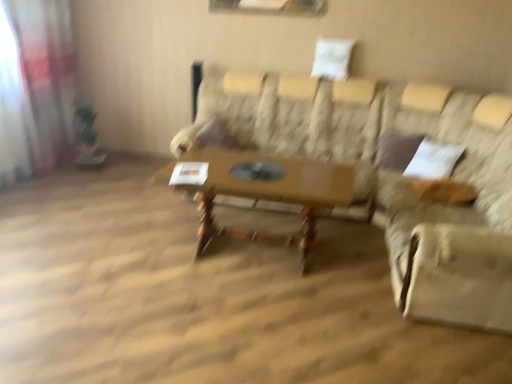
You are a GUI agent. You are given a task and a screenshot of the screen. Output one action in this format:
    pyautogui.click(x=<x>, y=<y>)
    Task: Click on the vacant area to the right of wooden table at center
    The width and height of the screenshot is (512, 384).
    Given the screenshot: What is the action you would take?
    pyautogui.click(x=371, y=271)